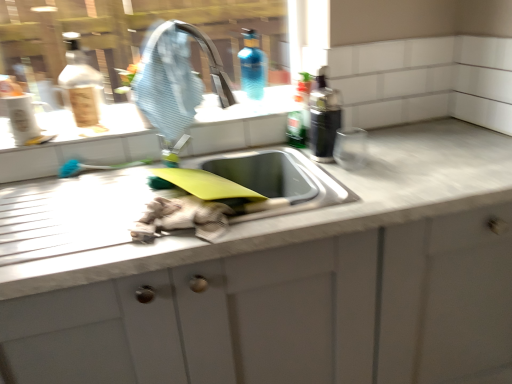
The image size is (512, 384). Identify the location of vacant space positioned to the left of blue glass bottle at upper center, arranged as the third bottle when viewed from the right. (218, 114).